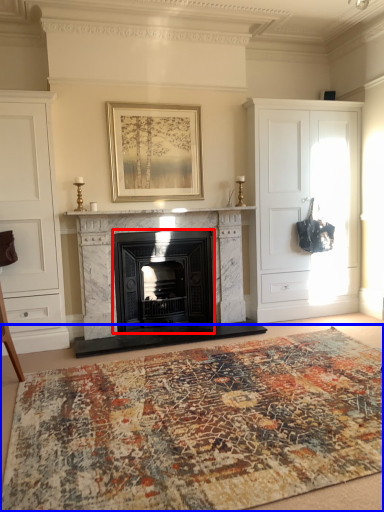
Question: Which point is closer to the camera, wood burning stove (highlighted by a red box) or mat (highlighted by a blue box)?

Choices:
 (A) wood burning stove
 (B) mat

Answer: (B)